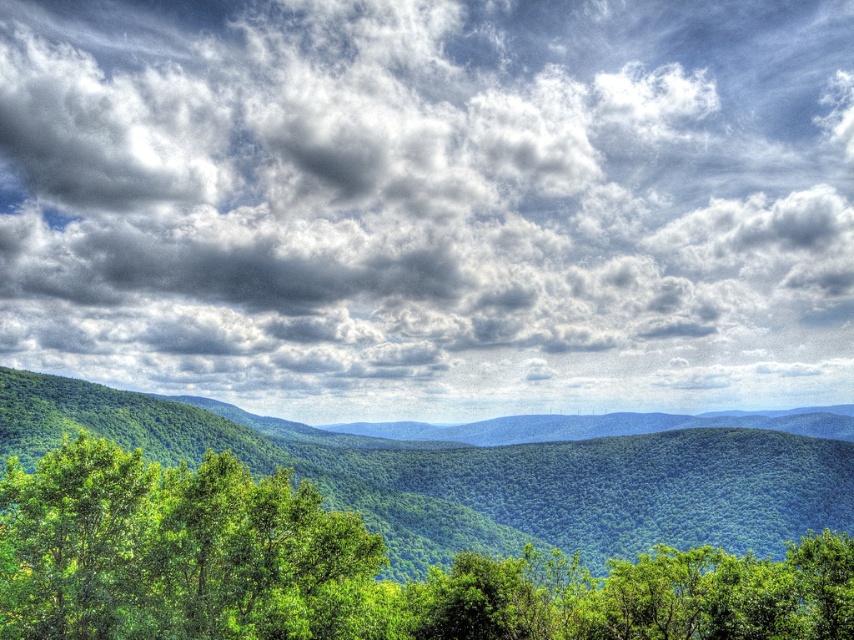
You are standing in the forest and see two points marked in the image. The first point is at coordinate point (536,17) and the second is at point (322,570). Which point is closer to you?

Point (536,17) is further to the viewer than point (322,570). Therefore, point (322,570) is closer to you.

You are standing in the forest looking at the cloudy sky at upper center and the green leafy tree at center. Which object is located higher in the image?

The cloudy sky at upper center is positioned over the green leafy tree at center, so it is higher in the image.